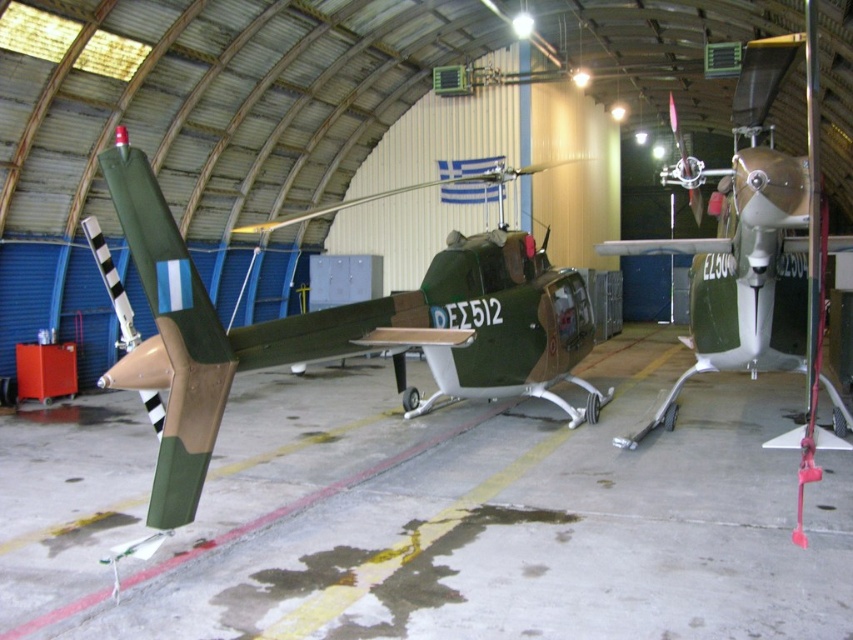
Question: Is matte green helicopter at center positioned behind metallic gold propeller at right?

Choices:
 (A) yes
 (B) no

Answer: (A)

Question: Among these objects, which one is nearest to the camera?

Choices:
 (A) matte green helicopter at center
 (B) metallic gold propeller at right

Answer: (B)

Question: Which point appears farthest from the camera in this image?

Choices:
 (A) (479, 244)
 (B) (732, 172)

Answer: (A)

Question: Does matte green helicopter at center appear under metallic gold propeller at right?

Choices:
 (A) no
 (B) yes

Answer: (B)

Question: Can you confirm if matte green helicopter at center is smaller than metallic gold propeller at right?

Choices:
 (A) yes
 (B) no

Answer: (A)